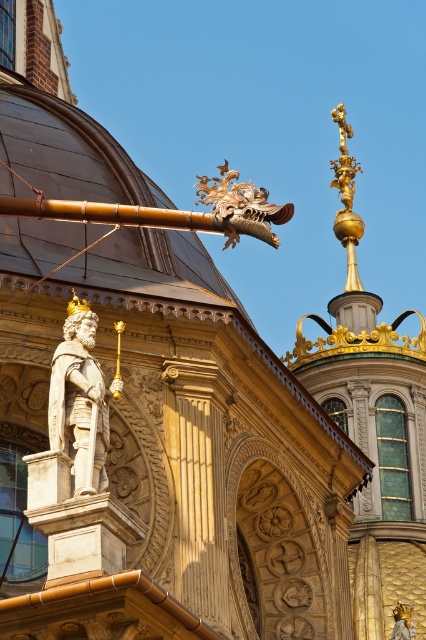
Can you confirm if polished bronze statue at center is taller than gold textured dragon at upper center?

No, polished bronze statue at center is not taller than gold textured dragon at upper center.

Is point (60, 408) positioned after point (236, 186)?

No, (60, 408) is closer to viewer.

This screenshot has height=640, width=426. What are the coordinates of `polished bronze statue at center` in the screenshot? It's located at (80, 400).